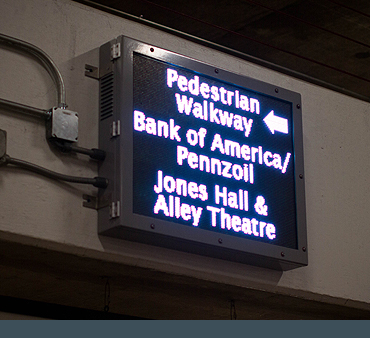
Locate an element on the screen. cable is located at coordinates (44, 171), (81, 149), (35, 51), (23, 109).